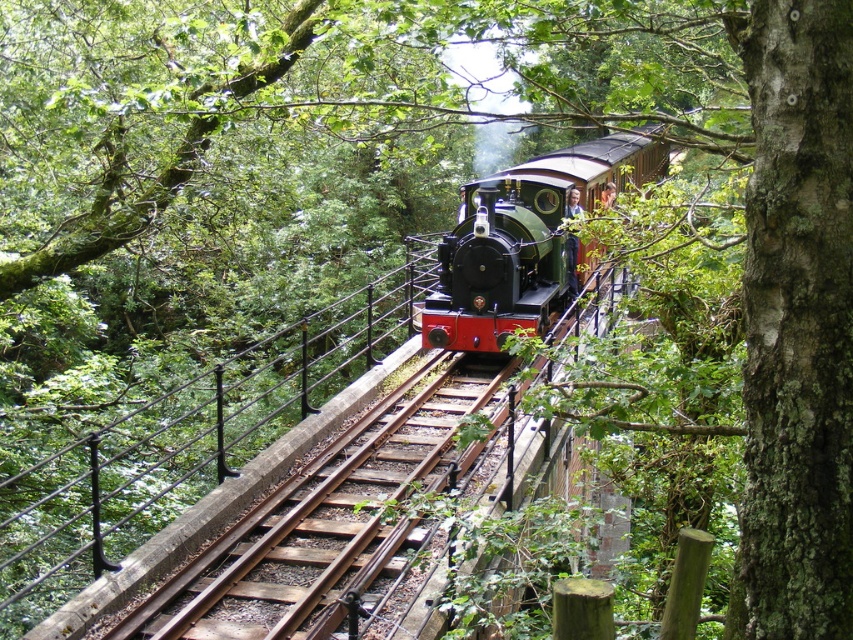
Question: Which of the following is the farthest from the observer?

Choices:
 (A) pos(599,170)
 (B) pos(312,400)

Answer: (B)

Question: Can you confirm if black metal rail at center is smaller than polished green locomotive at center?

Choices:
 (A) no
 (B) yes

Answer: (B)

Question: Can you confirm if black metal rail at center is bigger than polished green locomotive at center?

Choices:
 (A) no
 (B) yes

Answer: (A)

Question: Does black metal rail at center appear on the right side of polished green locomotive at center?

Choices:
 (A) yes
 (B) no

Answer: (B)